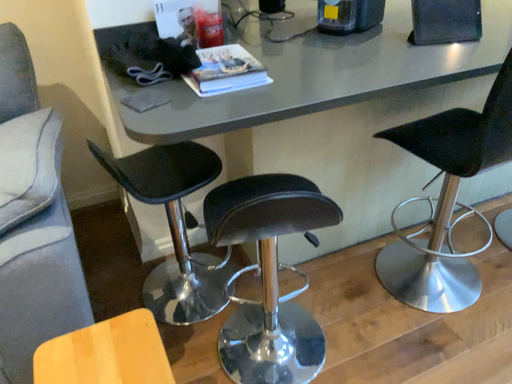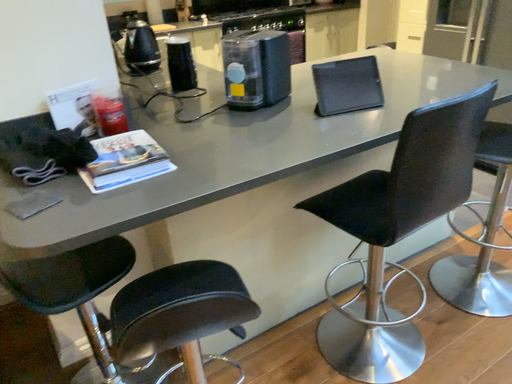
Question: How did the camera likely rotate when shooting the video?

Choices:
 (A) rotated downward
 (B) rotated upward

Answer: (B)